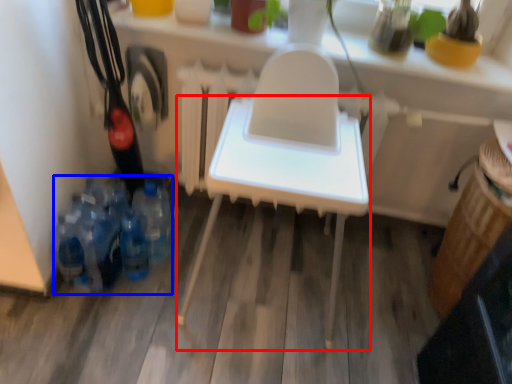
Question: Which of the following is the farthest to the observer, furniture (highlighted by a red box) or bottle (highlighted by a blue box)?

Choices:
 (A) furniture
 (B) bottle

Answer: (B)